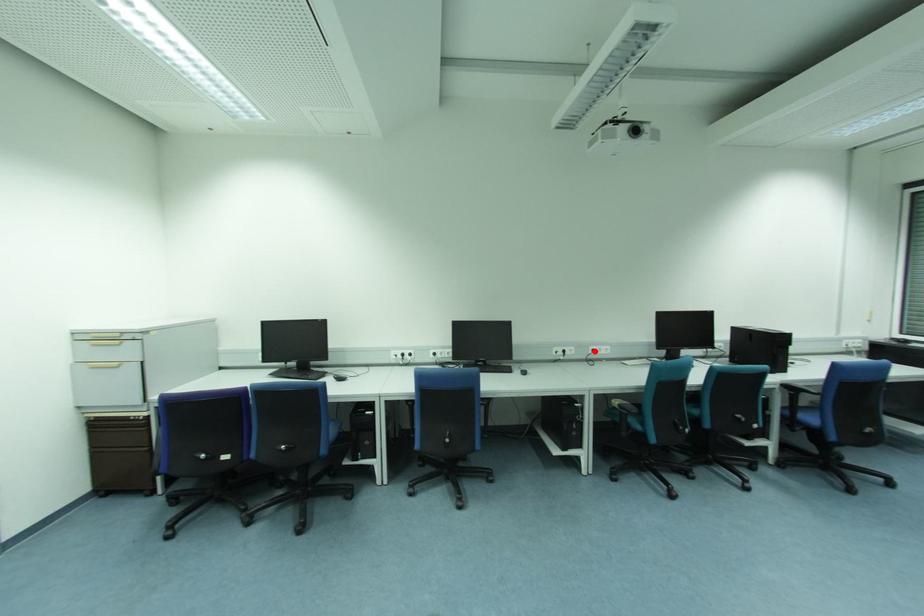
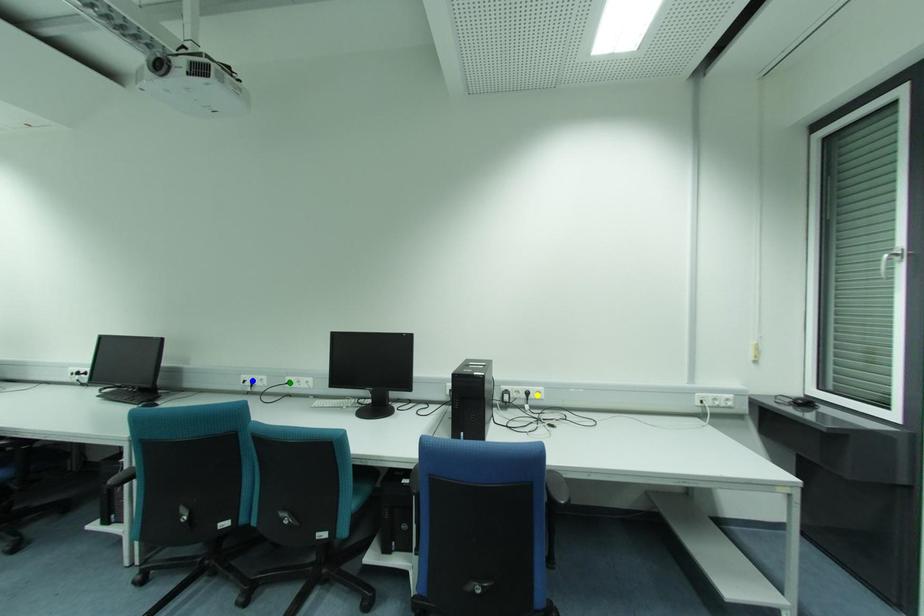
Question: I am providing you with two images of the same scene from different viewpoints. A red point is marked on the first image. You are given multiple points on the second image. Which point in image 2 is actually the same real-world point as the red point in image 1?

Choices:
 (A) yellow point
 (B) blue point
 (C) green point

Answer: (C)